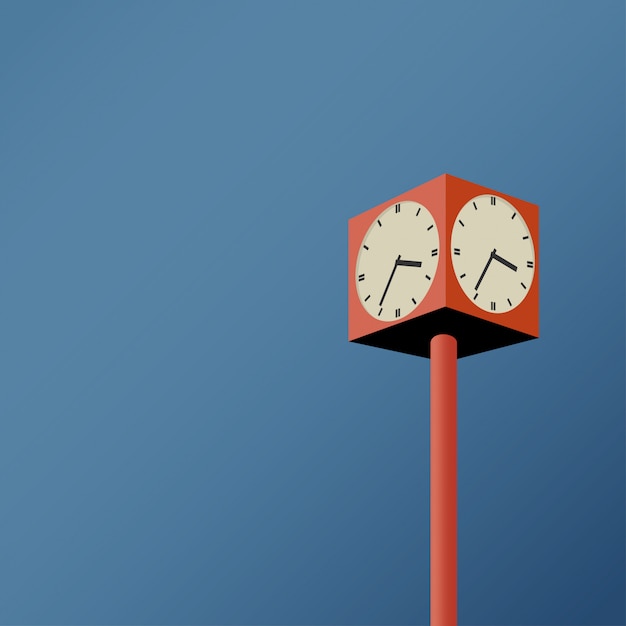
Where is `white clock face`? white clock face is located at coordinates (406, 238), (481, 240).